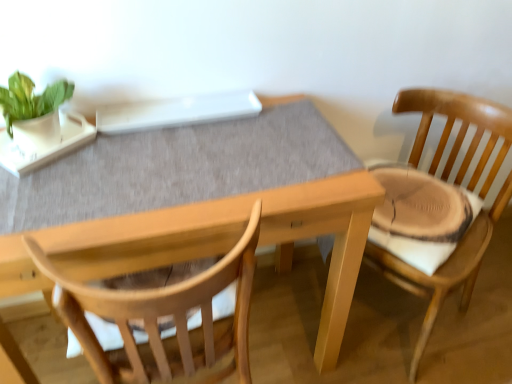
At what (x,y) coordinates should I click in order to perform the action: click on vacant area located to the right-hand side of green matte plant at upper left. Please return your answer as a coordinate pair (x, y). The image size is (512, 384). Looking at the image, I should click on (114, 154).